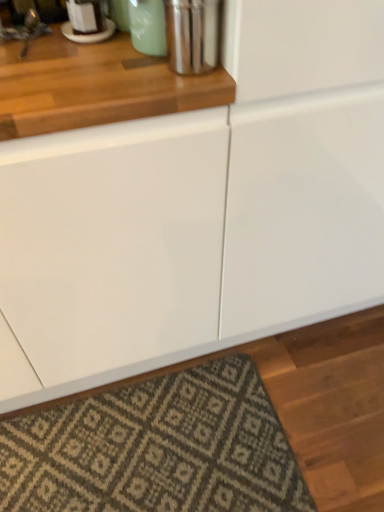
Where is `vacant space underneath textured beige rug at lower center (from a real-world perspective)`? This screenshot has height=512, width=384. vacant space underneath textured beige rug at lower center (from a real-world perspective) is located at coordinates pos(150,448).